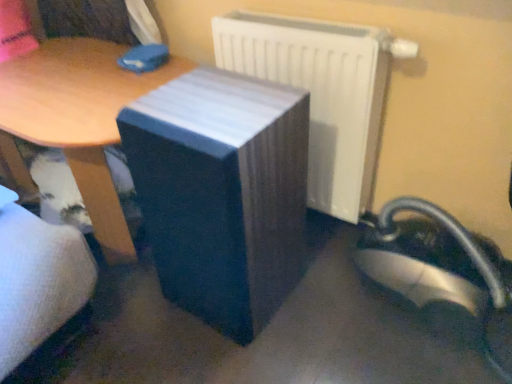
Find the location of a particular element. This screenshot has height=384, width=512. free space in front of matte black speaker at center, which is the second table from left to right is located at coordinates (239, 358).